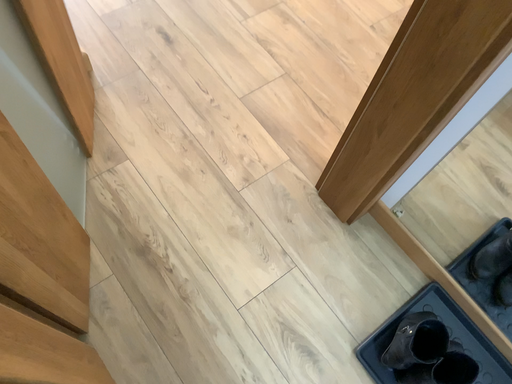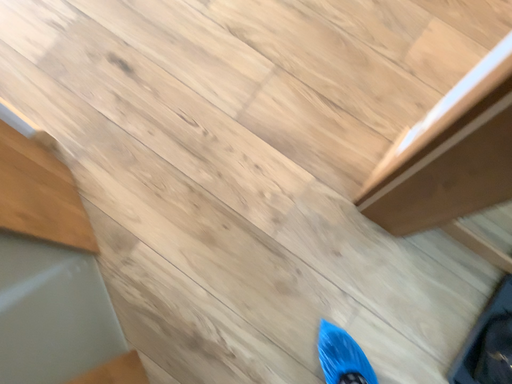
Question: Which way did the camera rotate in the video?

Choices:
 (A) rotated upward
 (B) rotated downward

Answer: (B)